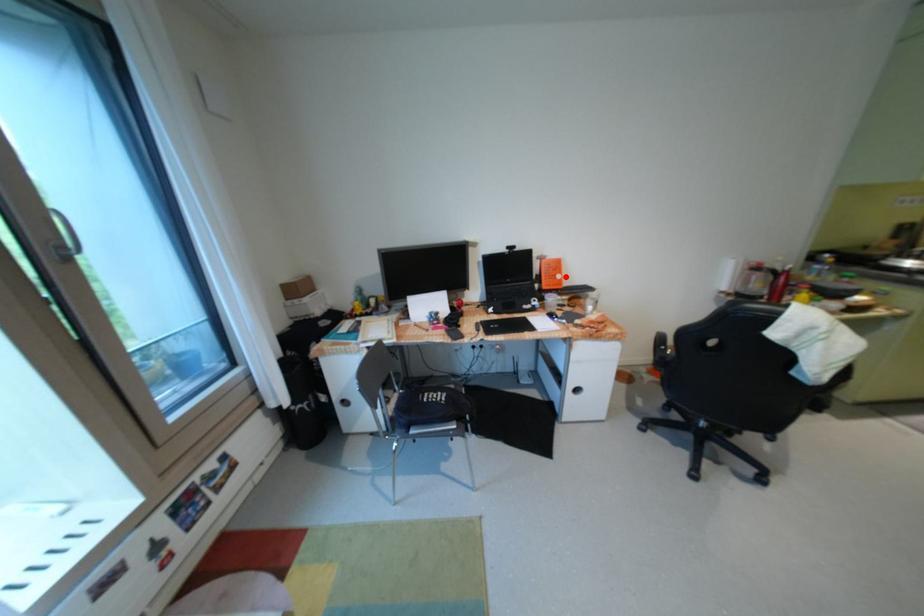
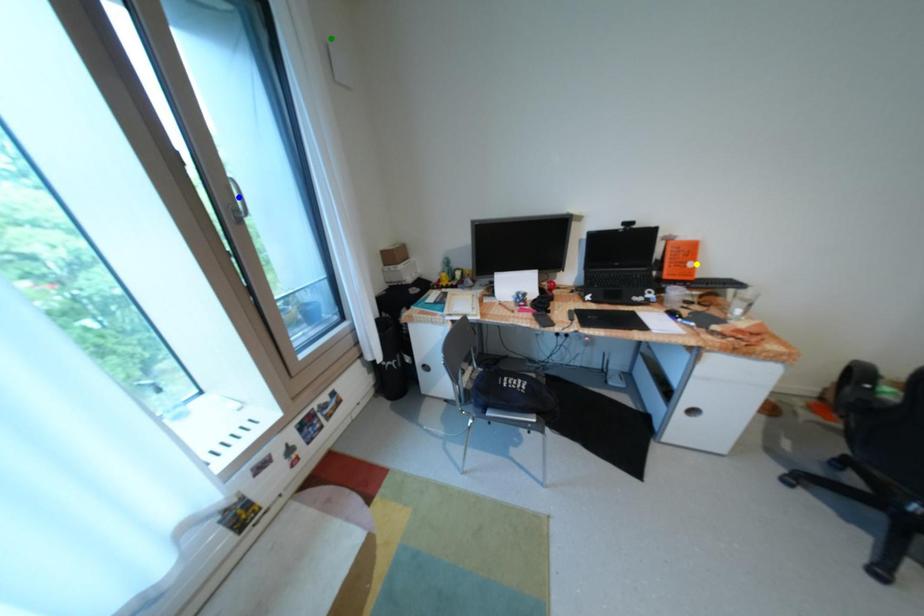
Question: I am providing you with two images of the same scene from different viewpoints. A red point is marked on the first image. You are given multiple points on the second image. Which point in image 2 is actually the same real-world point as the red point in image 1?

Choices:
 (A) blue point
 (B) green point
 (C) yellow point

Answer: (C)